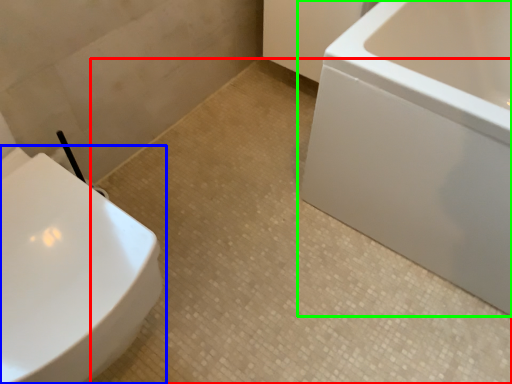
Question: Which is farther away from ceramic tile (highlighted by a red box)? toilet (highlighted by a blue box) or bathtub (highlighted by a green box)?

Choices:
 (A) toilet
 (B) bathtub

Answer: (A)